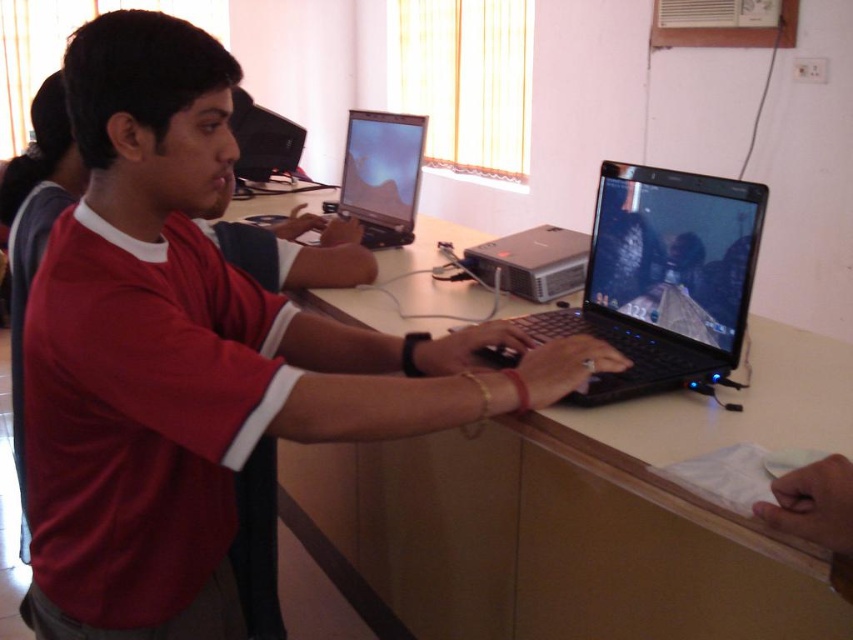
Question: Estimate the real-world distances between objects in this image. Which object is closer to the matte red shirt at center?

Choices:
 (A) white glossy table at center
 (B) black plastic computer at center
 (C) black glossy laptop at center

Answer: (C)

Question: Does matte red shirt at center have a lesser width compared to black plastic computer at center?

Choices:
 (A) no
 (B) yes

Answer: (A)

Question: Is matte red shirt at center above shiny black laptop at center?

Choices:
 (A) yes
 (B) no

Answer: (B)

Question: Estimate the real-world distances between objects in this image. Which object is farther from the matte red shirt at center?

Choices:
 (A) black glossy laptop at center
 (B) black plastic computer at center
 (C) white glossy table at center

Answer: (B)

Question: Can you confirm if matte red shirt at center is wider than black plastic computer at center?

Choices:
 (A) yes
 (B) no

Answer: (A)

Question: Estimate the real-world distances between objects in this image. Which object is closer to the black glossy laptop at center?

Choices:
 (A) matte red shirt at center
 (B) white glossy table at center
 (C) black plastic computer at center

Answer: (B)